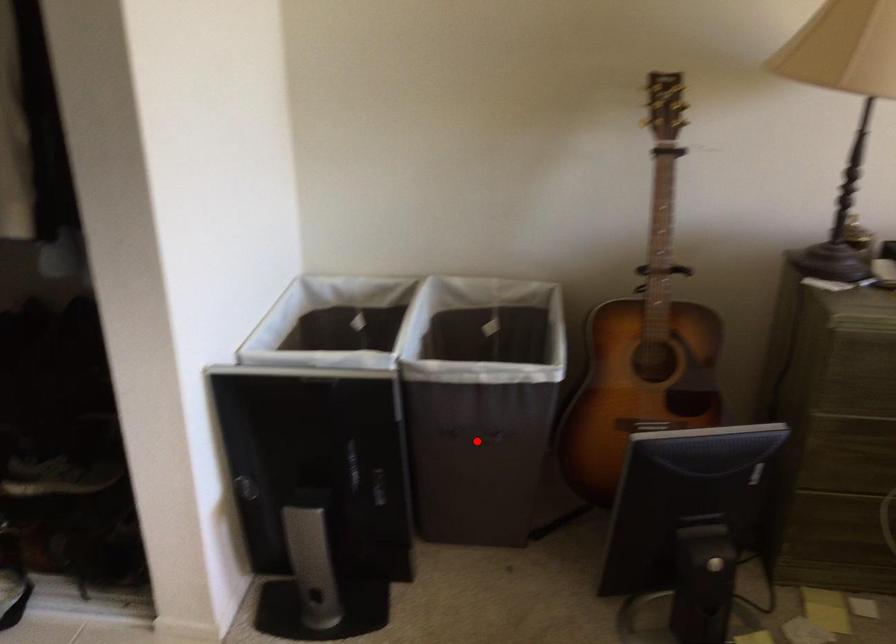
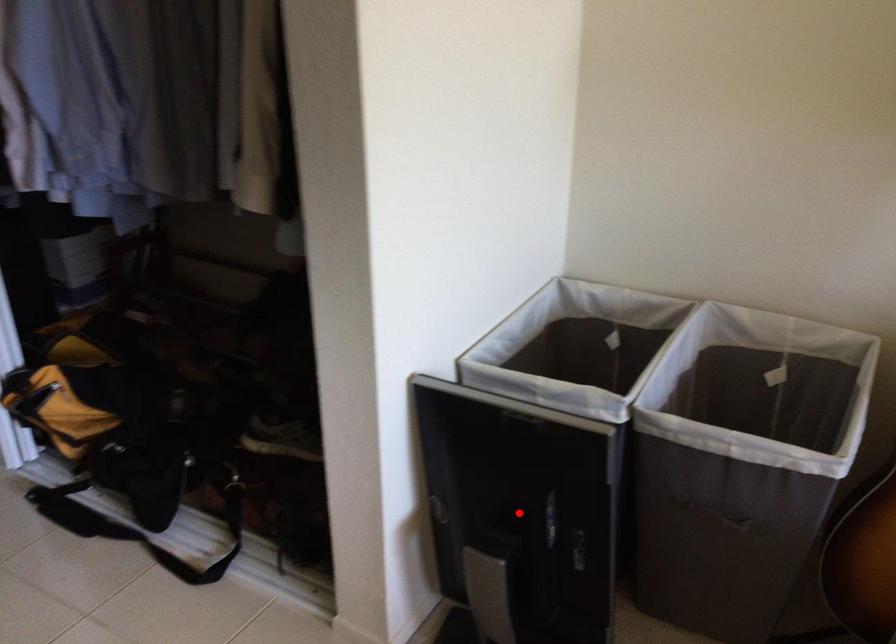
I am providing you with two images of the same scene from different viewpoints. A red point is marked on the first image and another point is marked on the second image. Does the point marked in image1 correspond to the same location as the one in image2?

No